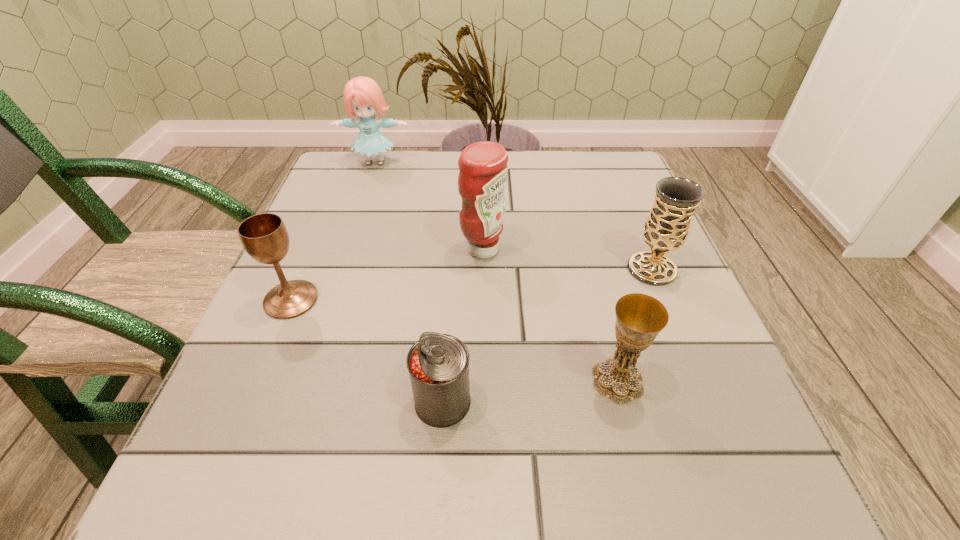
Identify the location of condiment. (483, 173).

Identify the location of the farthest object. Image resolution: width=960 pixels, height=540 pixels. (362, 96).

Where is `the rightmost object`? The image size is (960, 540). the rightmost object is located at coordinates (676, 199).

This screenshot has width=960, height=540. I want to click on the leftmost chalice, so click(x=264, y=236).

I want to click on the second chalice from right to left, so click(x=639, y=317).

Where is `the nearest chalice`? Image resolution: width=960 pixels, height=540 pixels. the nearest chalice is located at coordinates (639, 317).

Locate an element on the screen. can is located at coordinates (438, 364).

The height and width of the screenshot is (540, 960). I want to click on vacant space located 0.310m on the left of the condiment, so coord(305,249).

Locate an element on the screen. This screenshot has width=960, height=540. vacant space located on the front-facing side of the doll is located at coordinates (353, 228).

Locate an element on the screen. blank area located on the back of the rightmost object is located at coordinates (629, 214).